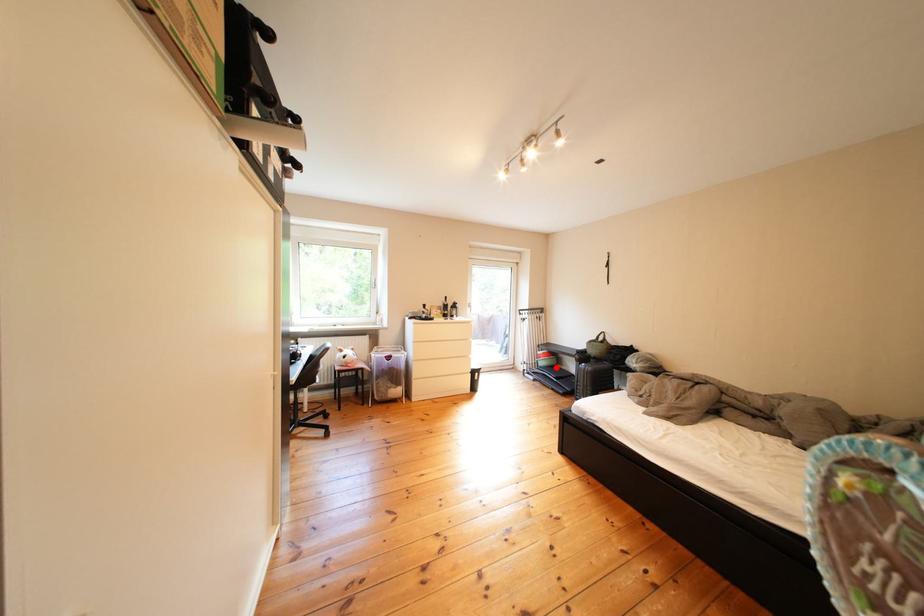
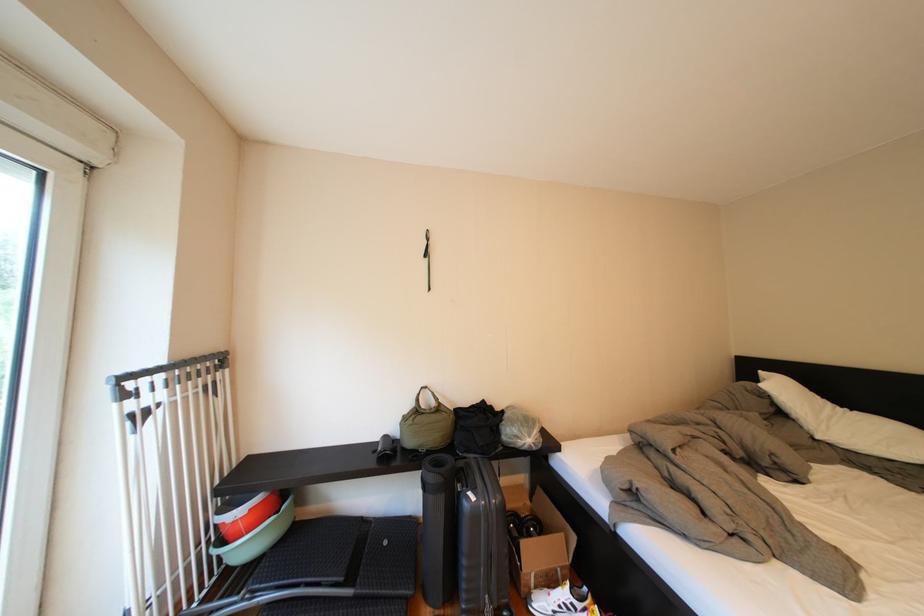
The point at the highlighted location is marked in the first image. Where is the corresponding point in the second image?

(261, 551)